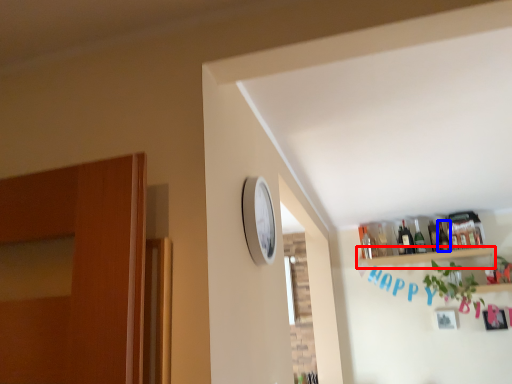
Question: Which object appears farthest to the camera in this image, shelf (highlighted by a red box) or bottle (highlighted by a blue box)?

Choices:
 (A) shelf
 (B) bottle

Answer: (B)